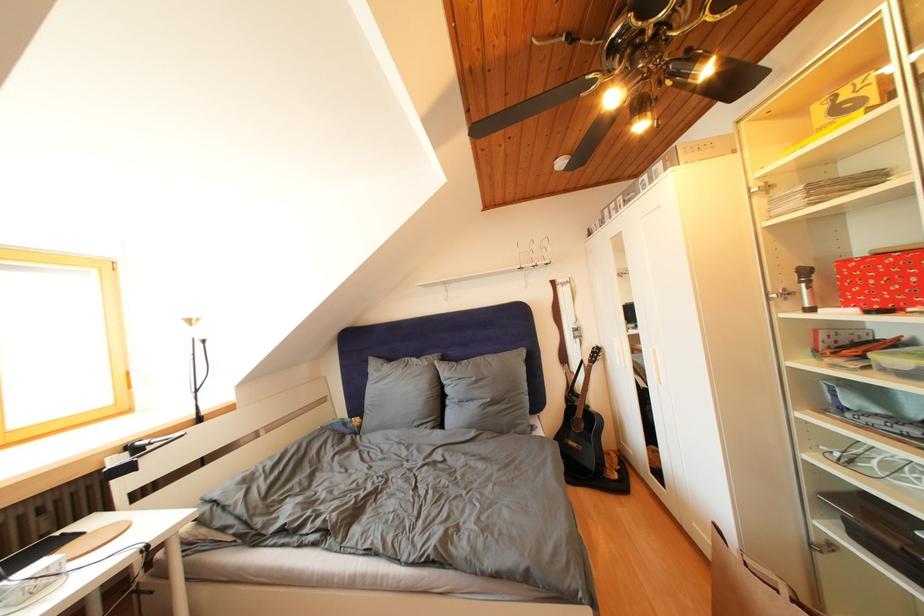
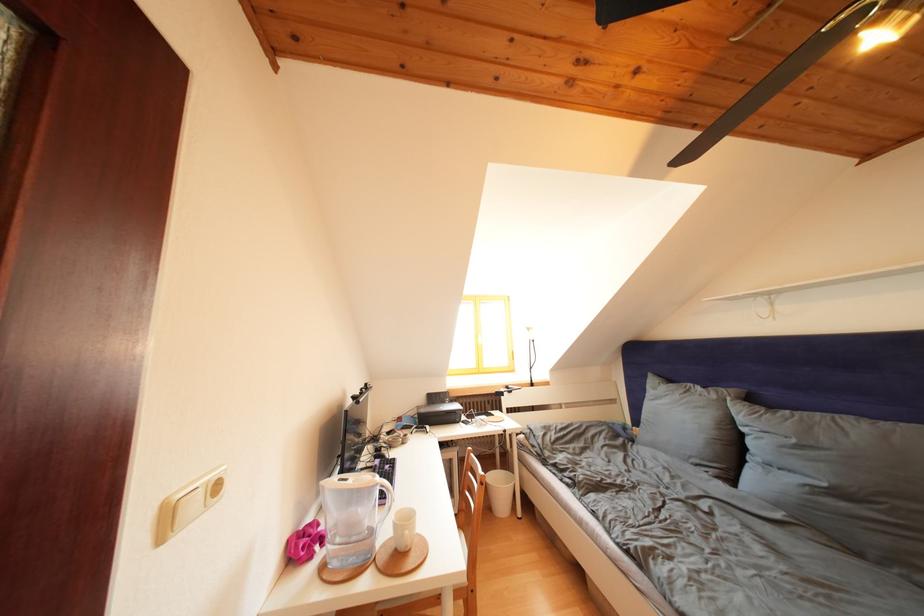
The point at (433, 369) is marked in the first image. Where is the corresponding point in the second image?

(722, 402)